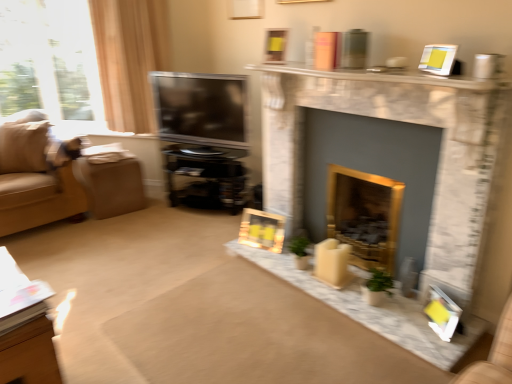
Question: From the image's perspective, is black glossy entertainment center at center above or below white marble fireplace at upper center?

Choices:
 (A) above
 (B) below

Answer: (B)

Question: In the image, is black glossy entertainment center at center positioned in front of or behind white marble fireplace at upper center?

Choices:
 (A) front
 (B) behind

Answer: (B)

Question: Estimate the real-world distances between objects in this image. Which object is farther from the wooden table at lower left?

Choices:
 (A) gold metallic fireplace at center, which appears as the 1th fireplace when viewed from the back
 (B) wooden picture frame at center, which appears as the second picture frame when ordered from the bottom
 (C) black glossy entertainment center at center
 (D) matte yellow picture frame at upper center, which ranks as the 2th picture frame in right-to-left order
 (E) suede beige couch at left

Answer: (D)

Question: Considering the real-world distances, which object is closest to the matte black tv at center?

Choices:
 (A) matte yellow picture frame at upper center, the third picture frame from the bottom
 (B) wooden table at lower left
 (C) brown fabric footrest at left
 (D) white marble fireplace at upper center
 (E) gold metallic fireplace at center, acting as the 2th fireplace starting from the front

Answer: (C)